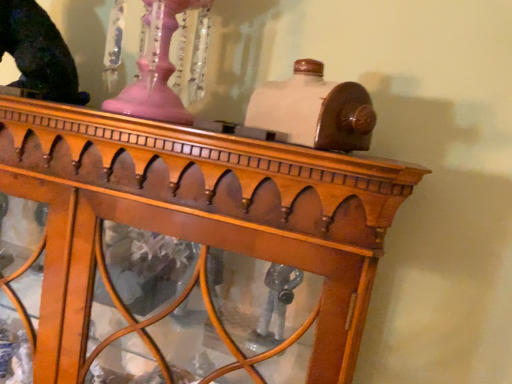
Question: Considering the relative positions of shiny black statue at upper left and wooden table at center in the image provided, is shiny black statue at upper left in front of wooden table at center?

Choices:
 (A) yes
 (B) no

Answer: (B)

Question: Does shiny black statue at upper left have a lesser width compared to wooden table at center?

Choices:
 (A) no
 (B) yes

Answer: (B)

Question: Considering the relative positions of shiny black statue at upper left and wooden table at center in the image provided, is shiny black statue at upper left to the left of wooden table at center from the viewer's perspective?

Choices:
 (A) yes
 (B) no

Answer: (A)

Question: Would you say shiny black statue at upper left is a long distance from wooden table at center?

Choices:
 (A) no
 (B) yes

Answer: (A)

Question: Is wooden table at center surrounded by shiny black statue at upper left?

Choices:
 (A) no
 (B) yes

Answer: (A)

Question: Is shiny black statue at upper left further to the viewer compared to wooden table at center?

Choices:
 (A) yes
 (B) no

Answer: (A)

Question: Is wooden table at center positioned beyond the bounds of shiny black statue at upper left?

Choices:
 (A) no
 (B) yes

Answer: (B)

Question: From the image's perspective, would you say wooden table at center is positioned over shiny black statue at upper left?

Choices:
 (A) yes
 (B) no

Answer: (B)

Question: Does wooden table at center have a lesser height compared to shiny black statue at upper left?

Choices:
 (A) no
 (B) yes

Answer: (A)

Question: Can you confirm if wooden table at center is positioned to the right of shiny black statue at upper left?

Choices:
 (A) no
 (B) yes

Answer: (B)

Question: Considering the relative positions of wooden table at center and shiny black statue at upper left in the image provided, is wooden table at center behind shiny black statue at upper left?

Choices:
 (A) yes
 (B) no

Answer: (B)

Question: Is wooden table at center bigger than shiny black statue at upper left?

Choices:
 (A) no
 (B) yes

Answer: (B)

Question: Considering the positions of shiny black statue at upper left and wooden table at center in the image, is shiny black statue at upper left taller or shorter than wooden table at center?

Choices:
 (A) tall
 (B) short

Answer: (B)